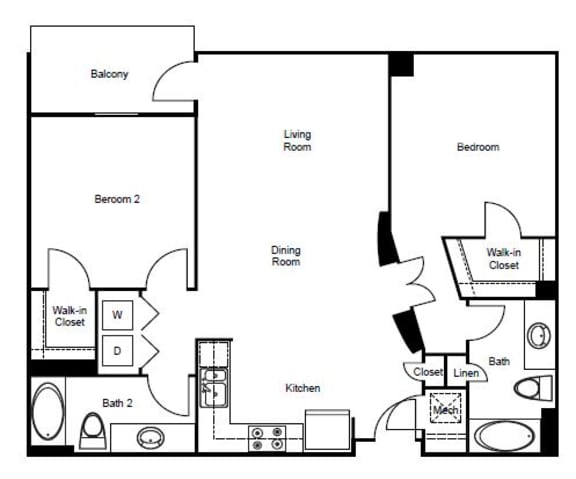
The image size is (576, 479). Identify the location of faucet. coord(207,381).